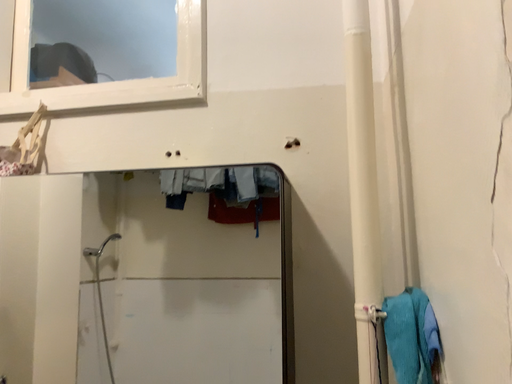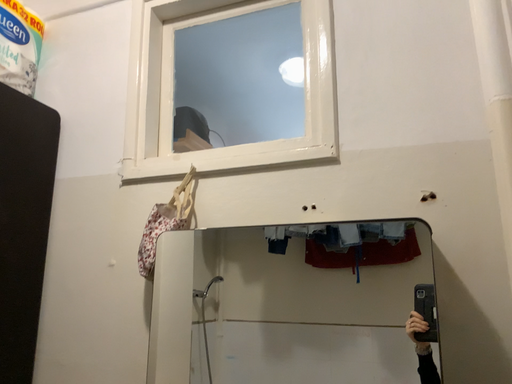
Question: Which way did the camera rotate in the video?

Choices:
 (A) rotated left
 (B) rotated right

Answer: (A)